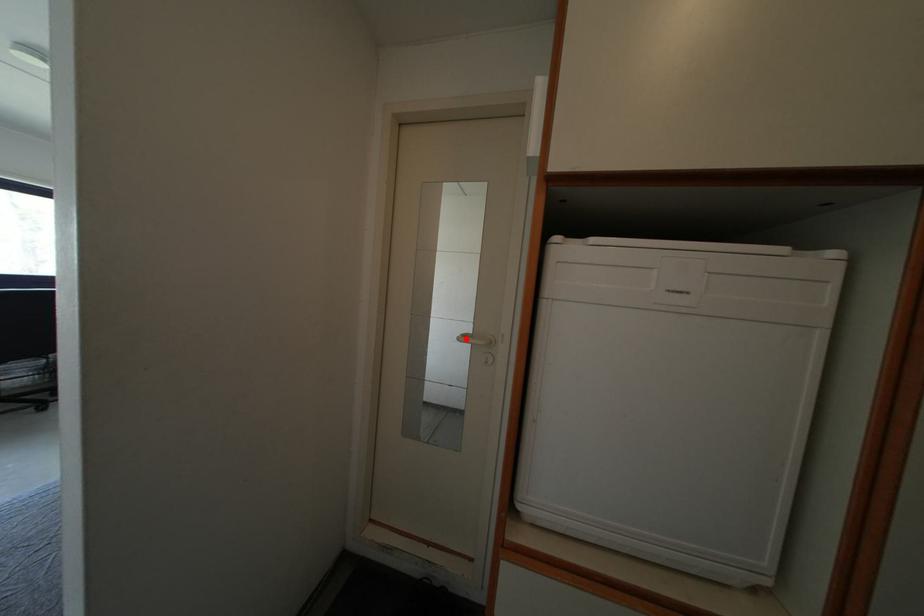
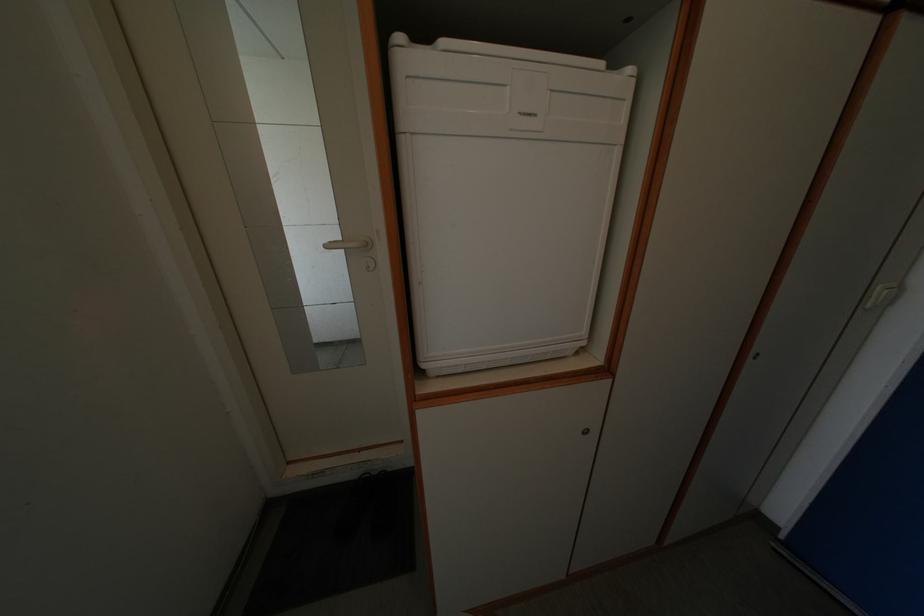
Where in the second image is the point corresponding to the highlighted location from the first image?

(332, 246)